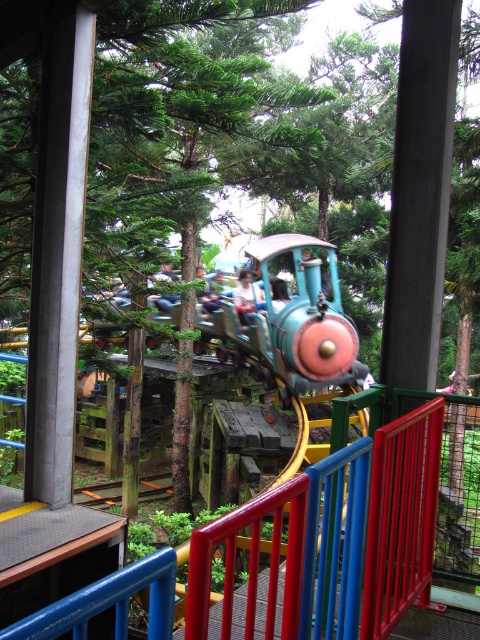
From the picture: You are a photographer standing on the platform near the railing. You want to take a photo of the shiny blue train at center and the light blue fabric shirt at center. Which object should you focus on first if you want to capture both in the same frame without moving your camera?

The shiny blue train at center might be wider than the light blue fabric shirt at center, so you should focus on the shiny blue train at center first to ensure it fits in the frame.

You are a visitor at the theme park and want to take a photo of the shiny blue train at center and the light blue fabric shirt at center from the railing. Which object should you aim your camera at first if you want to capture both in one shot without moving the camera?

You should aim your camera at the light blue fabric shirt at center first because the shiny blue train at center is to the right of it, so by centering the shirt, the train will naturally be in the frame to its right.